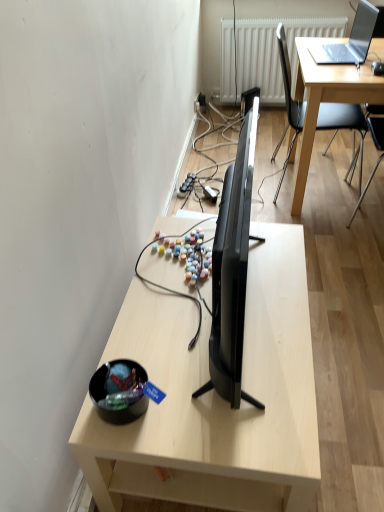
Question: Is white textured radiator at upper center wider or thinner than black plastic chair at upper right?

Choices:
 (A) thin
 (B) wide

Answer: (A)

Question: Is white textured radiator at upper center in front of or behind black plastic chair at upper right in the image?

Choices:
 (A) behind
 (B) front

Answer: (A)

Question: Estimate the real-world distances between objects in this image. Which object is farther from the black glossy tv at center?

Choices:
 (A) sleek silver laptop at upper right
 (B) light wood desk at center
 (C) white textured radiator at upper center
 (D) shiny black bowl at lower left
 (E) black plastic chair at upper right

Answer: (E)

Question: Estimate the real-world distances between objects in this image. Which object is farther from the light wood desk at center?

Choices:
 (A) sleek silver laptop at upper right
 (B) white textured radiator at upper center
 (C) black plastic chair at upper right
 (D) black glossy tv at center
 (E) shiny black bowl at lower left

Answer: (B)